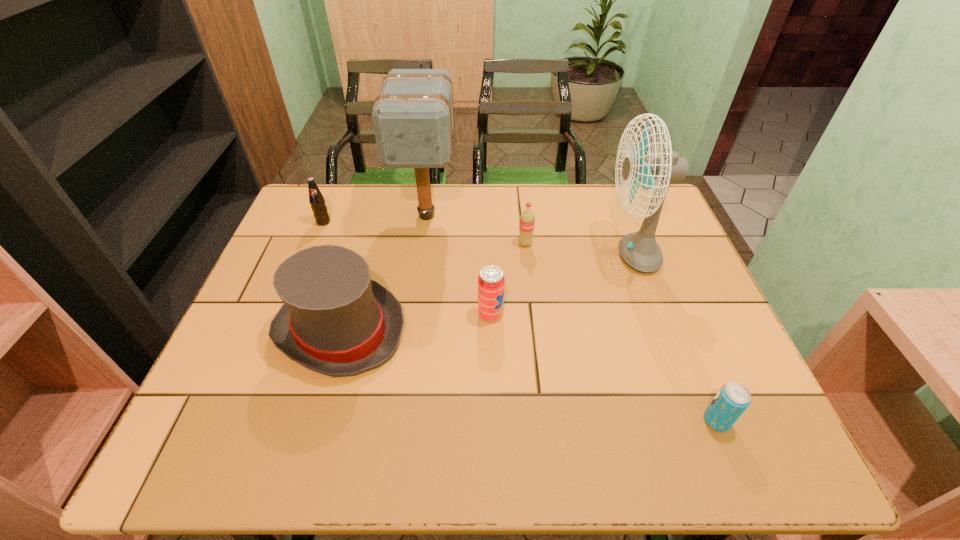
In the image, there is a desktop. Where is `blank space at the far edge`? blank space at the far edge is located at coordinates (459, 225).

Find the location of `vacant space at the near edge of the desktop`. vacant space at the near edge of the desktop is located at coordinates (689, 443).

The width and height of the screenshot is (960, 540). What are the coordinates of `vacant space at the left edge` in the screenshot? It's located at (278, 384).

In order to click on vacant point at the right edge in this screenshot , I will do (x=667, y=264).

In the image, there is a desktop. Where is `vacant area at the near left corner`? Image resolution: width=960 pixels, height=540 pixels. vacant area at the near left corner is located at coordinates (233, 449).

In the image, there is a desktop. Where is `vacant space at the far right corner`? This screenshot has width=960, height=540. vacant space at the far right corner is located at coordinates (666, 230).

In order to click on vacant region between the mallet and the third tallest object in this screenshot , I will do click(x=383, y=273).

Identify the location of empty location between the leftmost soda can and the mallet. (375, 219).

This screenshot has height=540, width=960. I want to click on vacant space in between the shortest soda can and the second soda can from left to right, so click(604, 367).

At what (x,y) coordinates should I click in order to perform the action: click on vacant area that lies between the dress hat and the second nearest soda can. Please return your answer as a coordinate pair (x, y). Looking at the image, I should click on pyautogui.click(x=416, y=322).